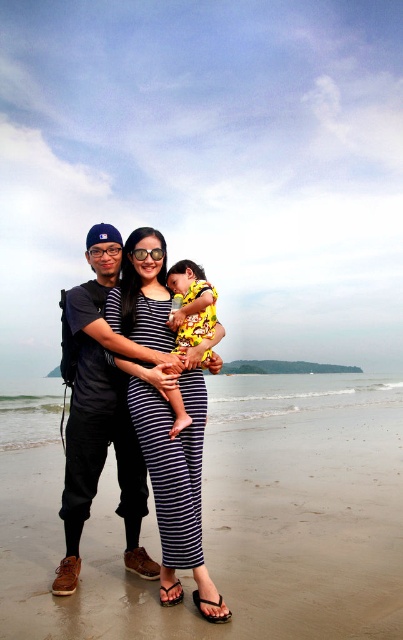
How distant is brown sand at lower center from striped fabric dress at center?

brown sand at lower center and striped fabric dress at center are 5.73 meters apart from each other.

From the picture: Who is shorter, brown sand at lower center or striped fabric dress at center?

brown sand at lower center

Describe the element at coordinates (234, 524) in the screenshot. This screenshot has width=403, height=640. I see `brown sand at lower center` at that location.

Identify the location of brown sand at lower center. The width and height of the screenshot is (403, 640). (234, 524).

Is striped fabric dress at center taller than yellow printed fabric at center?

Yes, striped fabric dress at center is taller than yellow printed fabric at center.

I want to click on striped fabric dress at center, so click(x=174, y=476).

Is brown sand at lower center below matte black backpack at left?

Indeed, brown sand at lower center is positioned under matte black backpack at left.

Can you confirm if brown sand at lower center is smaller than matte black backpack at left?

No.

Is point (2, 413) positioned behind point (126, 442)?

Yes, it is behind point (126, 442).

Locate an element on the screen. brown sand at lower center is located at coordinates (234, 524).